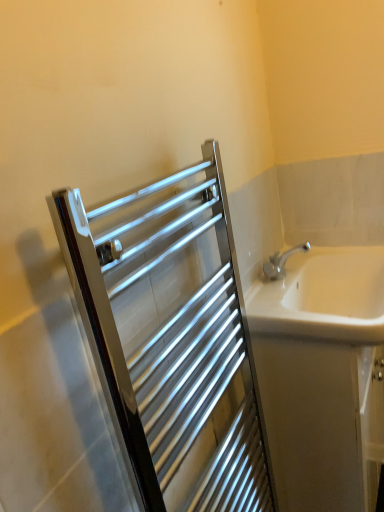
Question: From a real-world perspective, is white glossy bathtub at right physically below polished chrome towel rack at upper left?

Choices:
 (A) no
 (B) yes

Answer: (B)

Question: Would you say white glossy bathtub at right is outside polished chrome towel rack at upper left?

Choices:
 (A) yes
 (B) no

Answer: (A)

Question: Does white glossy bathtub at right have a greater width compared to polished chrome towel rack at upper left?

Choices:
 (A) no
 (B) yes

Answer: (B)

Question: Is white glossy bathtub at right positioned before polished chrome towel rack at upper left?

Choices:
 (A) no
 (B) yes

Answer: (A)

Question: From the image's perspective, is white glossy bathtub at right over polished chrome towel rack at upper left?

Choices:
 (A) no
 (B) yes

Answer: (A)

Question: Considering the relative sizes of white glossy bathtub at right and polished chrome towel rack at upper left in the image provided, is white glossy bathtub at right thinner than polished chrome towel rack at upper left?

Choices:
 (A) yes
 (B) no

Answer: (B)

Question: Can you confirm if polished chrome towel rack at upper left is bigger than white glossy bathtub at right?

Choices:
 (A) no
 (B) yes

Answer: (A)

Question: From a real-world perspective, is polished chrome towel rack at upper left below white glossy bathtub at right?

Choices:
 (A) no
 (B) yes

Answer: (A)

Question: From a real-world perspective, does polished chrome towel rack at upper left stand above white glossy bathtub at right?

Choices:
 (A) no
 (B) yes

Answer: (B)

Question: Is polished chrome towel rack at upper left facing towards white glossy bathtub at right?

Choices:
 (A) no
 (B) yes

Answer: (A)

Question: Does polished chrome towel rack at upper left touch white glossy bathtub at right?

Choices:
 (A) yes
 (B) no

Answer: (B)

Question: Considering the relative sizes of polished chrome towel rack at upper left and white glossy bathtub at right in the image provided, is polished chrome towel rack at upper left smaller than white glossy bathtub at right?

Choices:
 (A) yes
 (B) no

Answer: (A)

Question: Is white glossy bathtub at right closer to the viewer compared to white ceramic sink at right?

Choices:
 (A) no
 (B) yes

Answer: (A)